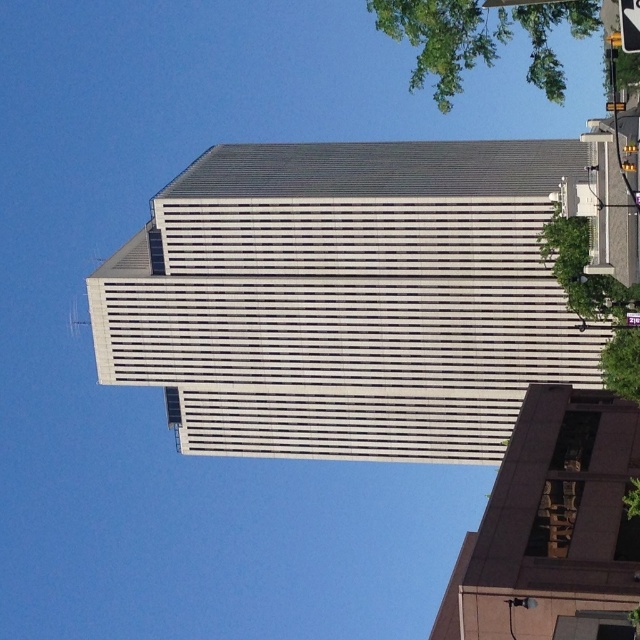
Who is positioned more to the right, gray concrete building at center or brown textured building at lower right?

From the viewer's perspective, brown textured building at lower right appears more on the right side.

Can you confirm if gray concrete building at center is shorter than brown textured building at lower right?

Incorrect, gray concrete building at center's height does not fall short of brown textured building at lower right's.

Is point (460, 289) closer to camera compared to point (577, 611)?

No, it is behind (577, 611).

Image resolution: width=640 pixels, height=640 pixels. Identify the location of gray concrete building at center. (346, 298).

Which is more to the right, brown textured building at lower right or green leafy tree at right?

green leafy tree at right

Which is behind, point (522, 490) or point (624, 356)?

The point (624, 356) is more distant.

Describe the element at coordinates (552, 528) in the screenshot. The image size is (640, 640). I see `brown textured building at lower right` at that location.

Where is `brown textured building at lower right`? The image size is (640, 640). brown textured building at lower right is located at coordinates (552, 528).

Is point (404, 230) positioned behind point (593, 26)?

Yes, it is behind point (593, 26).

Which is behind, point (316, 349) or point (486, 13)?

Positioned behind is point (486, 13).

The image size is (640, 640). Find the location of `gray concrete building at center`. gray concrete building at center is located at coordinates (346, 298).

Identify the location of gray concrete building at center. (346, 298).